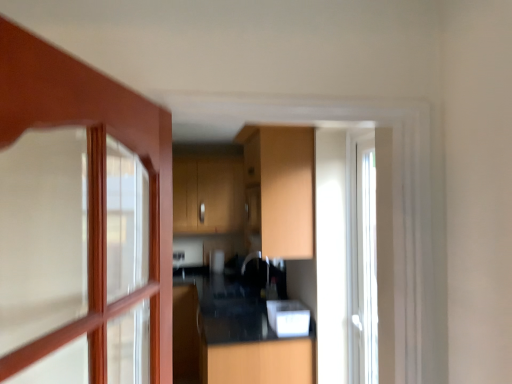
Question: Is black glossy counter top at center to the left or to the right of matte wood cabinet at center in the image?

Choices:
 (A) left
 (B) right

Answer: (A)

Question: Is black glossy counter top at center bigger or smaller than matte wood cabinet at center?

Choices:
 (A) small
 (B) big

Answer: (B)

Question: Which of these objects is positioned farthest from the white glossy microwave at center?

Choices:
 (A) matte wood cabinet at center
 (B) black glossy counter top at center

Answer: (B)

Question: Based on their relative distances, which object is nearer to the matte wood cabinet at center?

Choices:
 (A) black glossy counter top at center
 (B) white glossy microwave at center

Answer: (B)